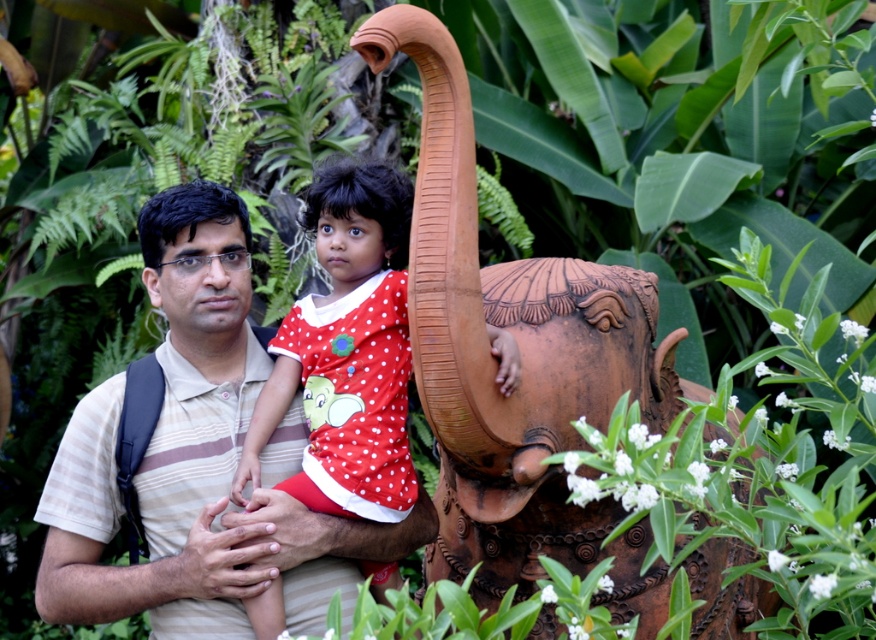
Is terracotta elephant at center to the left of polka dot fabric dress at center from the viewer's perspective?

In fact, terracotta elephant at center is to the right of polka dot fabric dress at center.

Does point (429, 209) come in front of point (315, 228)?

Yes, it is in front of point (315, 228).

The height and width of the screenshot is (640, 876). I want to click on terracotta elephant at center, so click(x=521, y=364).

Does terracotta elephant at center have a lesser width compared to striped cotton shirt at center?

No, terracotta elephant at center is not thinner than striped cotton shirt at center.

Which is below, terracotta elephant at center or striped cotton shirt at center?

terracotta elephant at center

This screenshot has width=876, height=640. What do you see at coordinates (521, 364) in the screenshot?
I see `terracotta elephant at center` at bounding box center [521, 364].

The image size is (876, 640). Find the location of `terracotta elephant at center`. terracotta elephant at center is located at coordinates (521, 364).

Consider the image. Does striped cotton shirt at center have a greater height compared to polka dot fabric dress at center?

Indeed, striped cotton shirt at center has a greater height compared to polka dot fabric dress at center.

Is striped cotton shirt at center wider than polka dot fabric dress at center?

Indeed, striped cotton shirt at center has a greater width compared to polka dot fabric dress at center.

Measure the distance between point (188, 289) and camera.

11.51 meters

In order to click on striped cotton shirt at center in this screenshot , I will do 185,456.